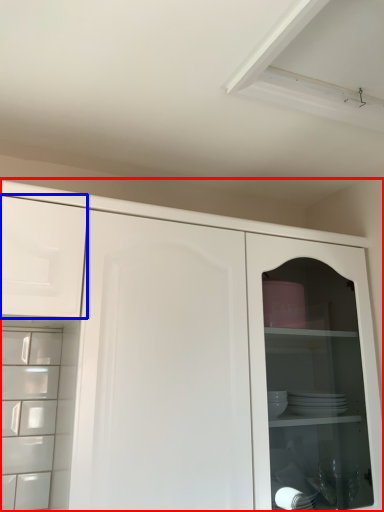
Question: Which object appears closest to the camera in this image, cupboard (highlighted by a red box) or drawer (highlighted by a blue box)?

Choices:
 (A) cupboard
 (B) drawer

Answer: (A)